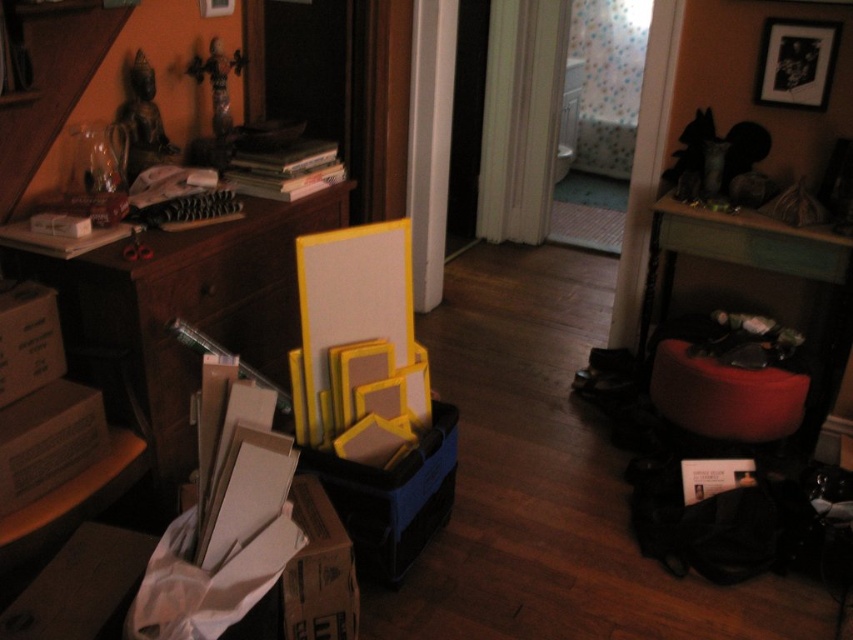
You are standing in the middle of the hallway and see the wooden drawer at center. Can you estimate its position relative to the staircase on the left side?

The wooden drawer at center is located at point (233, 272), which places it slightly to the right and forward of the staircase on the left side.